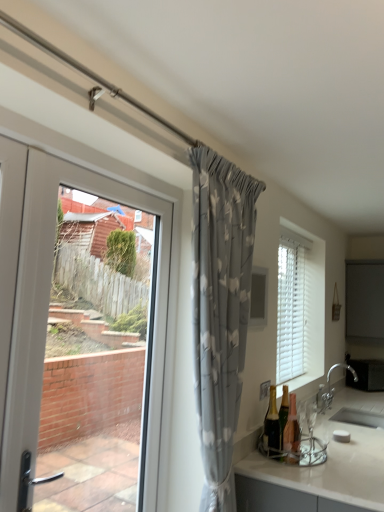
Question: Could matte glass bottle at lower right, marked as the first bottle in a right-to-left arrangement, be considered to be inside silver metallic faucet at lower right?

Choices:
 (A) no
 (B) yes

Answer: (A)

Question: Is silver metallic faucet at lower right behind matte glass bottle at lower right, which is the 2th bottle in left-to-right order?

Choices:
 (A) yes
 (B) no

Answer: (A)

Question: Is silver metallic faucet at lower right positioned with its back to matte glass bottle at lower right, marked as the first bottle in a right-to-left arrangement?

Choices:
 (A) yes
 (B) no

Answer: (B)

Question: Is silver metallic faucet at lower right located outside matte glass bottle at lower right, which is the 2th bottle in left-to-right order?

Choices:
 (A) yes
 (B) no

Answer: (A)

Question: Considering the relative sizes of silver metallic faucet at lower right and matte glass bottle at lower right, marked as the first bottle in a right-to-left arrangement, in the image provided, is silver metallic faucet at lower right taller than matte glass bottle at lower right, marked as the first bottle in a right-to-left arrangement,?

Choices:
 (A) no
 (B) yes

Answer: (B)

Question: Visually, is white glossy countertop at lower right positioned to the left or to the right of white wood blinds at right?

Choices:
 (A) right
 (B) left

Answer: (A)

Question: Would you say white glossy countertop at lower right is inside or outside white wood blinds at right?

Choices:
 (A) outside
 (B) inside

Answer: (A)

Question: From a real-world perspective, is white glossy countertop at lower right positioned above or below white wood blinds at right?

Choices:
 (A) above
 (B) below

Answer: (B)

Question: Does point 334,444 appear closer or farther from the camera than point 319,261?

Choices:
 (A) farther
 (B) closer

Answer: (B)

Question: From their relative heights in the image, would you say shiny gold bottle at lower right, which ranks as the 1th bottle in left-to-right order, is taller or shorter than silver metallic faucet at lower right?

Choices:
 (A) tall
 (B) short

Answer: (B)

Question: Considering the positions of shiny gold bottle at lower right, which ranks as the 1th bottle in left-to-right order, and silver metallic faucet at lower right in the image, is shiny gold bottle at lower right, which ranks as the 1th bottle in left-to-right order, wider or thinner than silver metallic faucet at lower right?

Choices:
 (A) thin
 (B) wide

Answer: (A)

Question: Do you think shiny gold bottle at lower right, which ranks as the 1th bottle in left-to-right order, is within silver metallic faucet at lower right, or outside of it?

Choices:
 (A) outside
 (B) inside

Answer: (A)

Question: Does point (271, 423) appear closer or farther from the camera than point (322, 410)?

Choices:
 (A) closer
 (B) farther

Answer: (A)

Question: Does point (332, 388) appear closer or farther from the camera than point (271, 422)?

Choices:
 (A) closer
 (B) farther

Answer: (B)

Question: Considering the positions of silver metallic faucet at lower right and shiny gold bottle at lower right, which ranks as the 1th bottle in left-to-right order, in the image, is silver metallic faucet at lower right wider or thinner than shiny gold bottle at lower right, which ranks as the 1th bottle in left-to-right order,?

Choices:
 (A) wide
 (B) thin

Answer: (A)